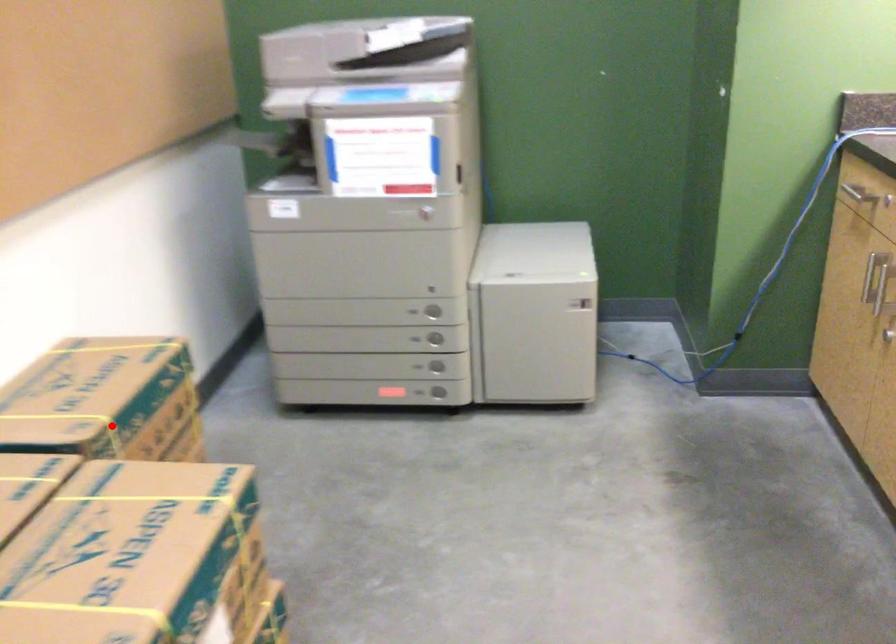
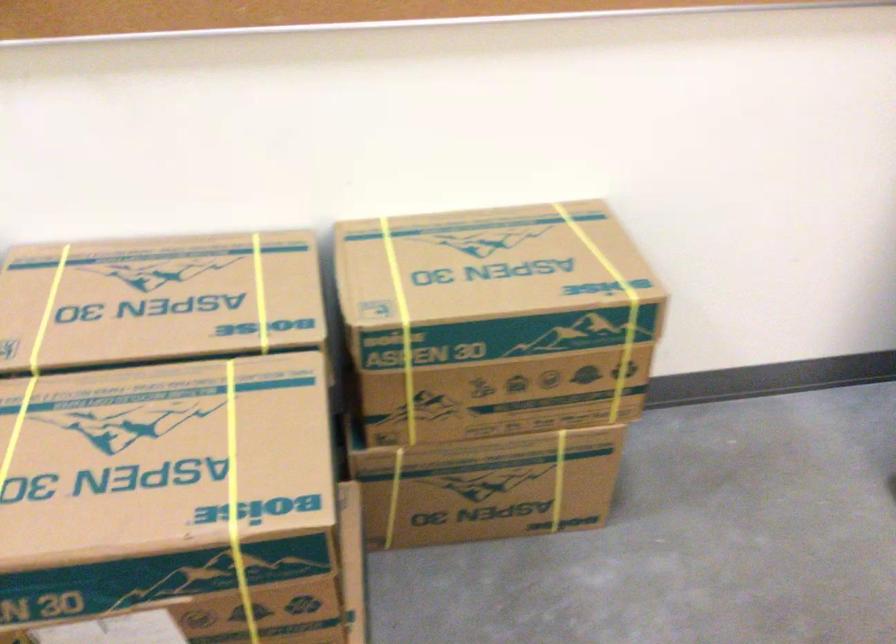
The point at the highlighted location is marked in the first image. Where is the corresponding point in the second image?

(401, 327)